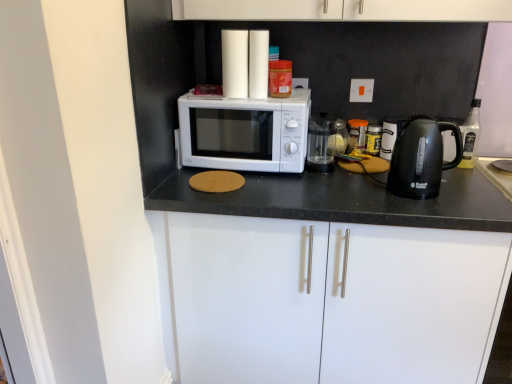
Locate an element on the screen. The image size is (512, 384). vacant area located to the right-hand side of black plastic kettle at right is located at coordinates (480, 188).